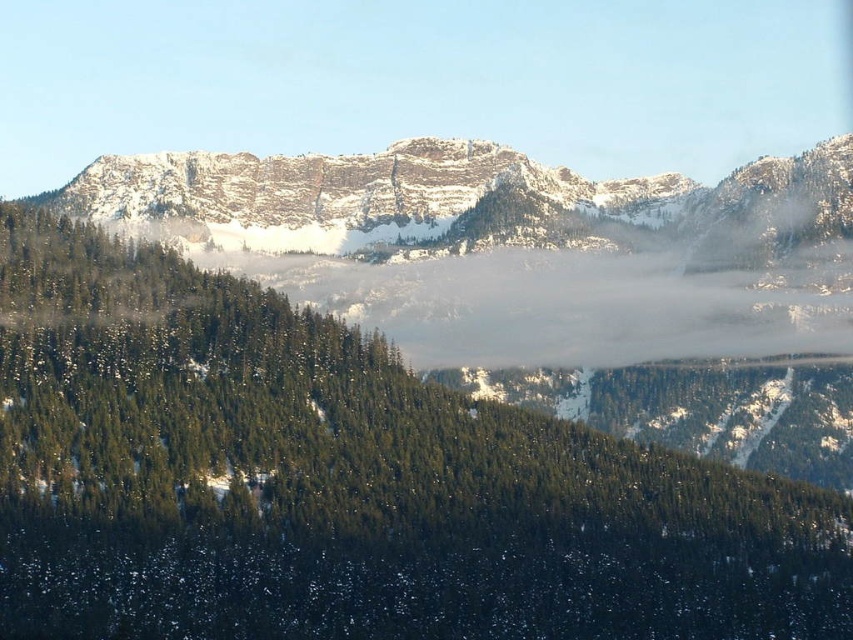
You are a hiker planning to traverse from point A to point B in the mountainous area. Point A is located at coordinates point (248, 308) and point B is at point (833, 184). Considering the terrain described in the scene, which direction should you head to reach point B from point A?

To reach point B from point A, you should head towards the upper right direction since point (248, 308) is in front of point (833, 184), indicating that point B is behind and to the upper right of point A.

You are planning to take a photo of the green matte tree at center and the snowy rock formation at center. Which object appears narrower in the photo?

The green matte tree at center appears narrower than the snowy rock formation at center in the photo because it has a lesser width compared to it.